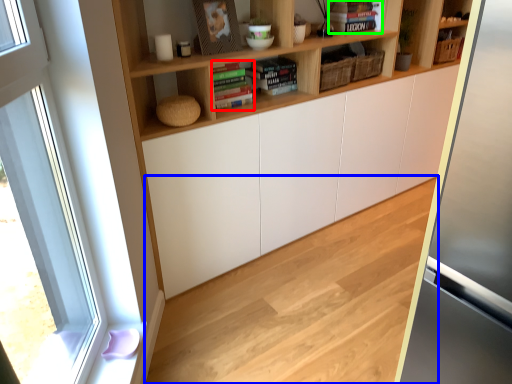
Question: Estimate the real-world distances between objects in this image. Which object is closer to book (highlighted by a red box), hardwood (highlighted by a blue box) or book (highlighted by a green box)?

Choices:
 (A) hardwood
 (B) book

Answer: (B)